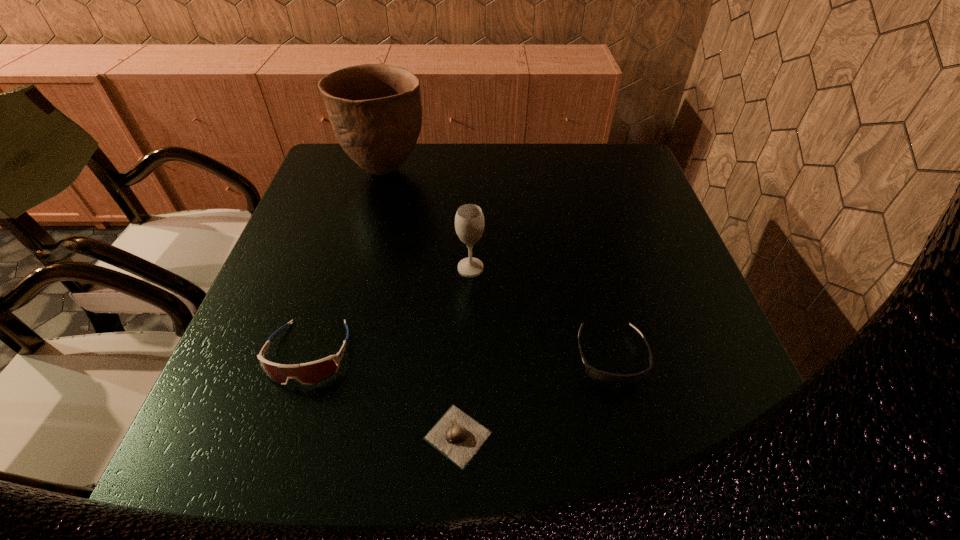
Find the location of a particular element. vacant space in between the nearest object and the fourth shortest object is located at coordinates (465, 352).

Where is `free space between the pottery and the wineglass`? This screenshot has height=540, width=960. free space between the pottery and the wineglass is located at coordinates tap(428, 219).

Identify the location of vacant area that lies between the shorter goggles and the pottery. The image size is (960, 540). (498, 264).

The height and width of the screenshot is (540, 960). What are the coordinates of `empty location between the nearest object and the fourth nearest object` in the screenshot? It's located at (465, 352).

I want to click on vacant point located between the nearest object and the fourth nearest object, so click(465, 352).

The width and height of the screenshot is (960, 540). I want to click on vacant space in between the taller goggles and the farthest object, so click(348, 262).

In order to click on the second closest object to the nearest object in this screenshot , I will do coord(609,379).

The image size is (960, 540). I want to click on object that is the third closest to the taller goggles, so click(x=375, y=110).